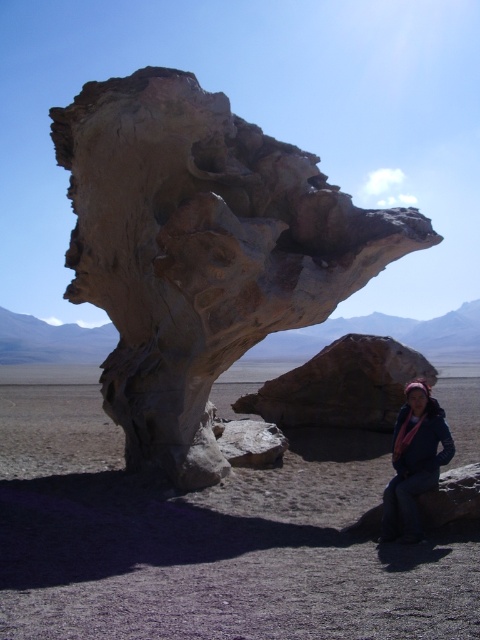
Question: Is rustic stone sculpture at center smaller than pink scarf at lower right?

Choices:
 (A) yes
 (B) no

Answer: (B)

Question: Is rustic stone sculpture at center above pink scarf at lower right?

Choices:
 (A) yes
 (B) no

Answer: (A)

Question: Does rustic stone sculpture at center have a smaller size compared to pink scarf at lower right?

Choices:
 (A) yes
 (B) no

Answer: (B)

Question: Which object appears farthest from the camera in this image?

Choices:
 (A) pink scarf at lower right
 (B) rustic stone sculpture at center

Answer: (B)